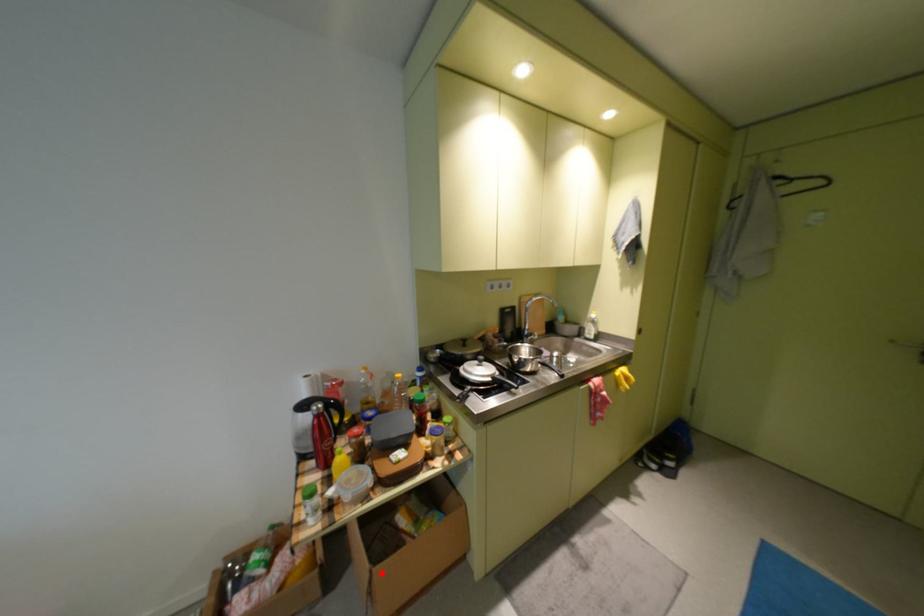
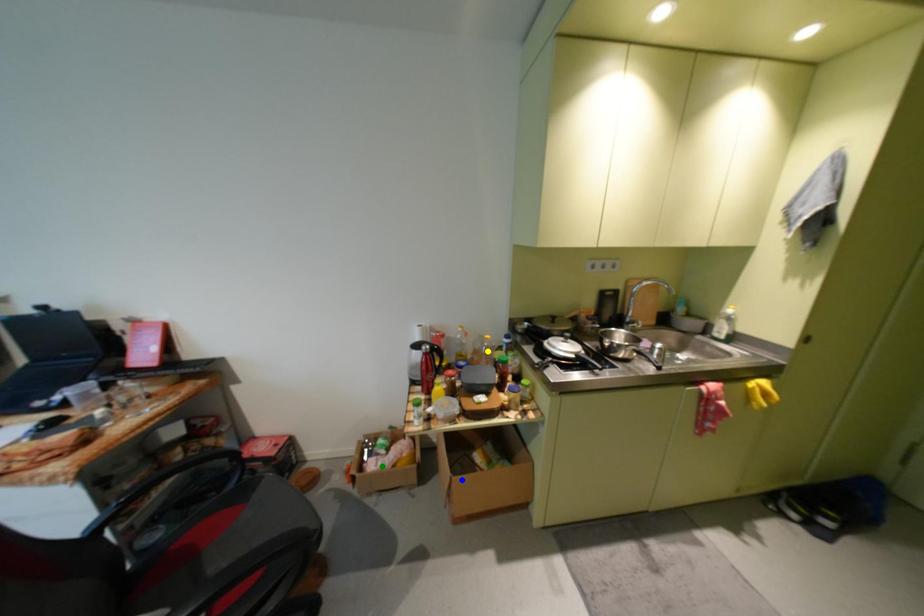
Question: I am providing you with two images of the same scene from different viewpoints. A red point is marked on the first image. You are given multiple points on the second image. Which spot in image 2 lines up with the point in image 1?

Choices:
 (A) blue point
 (B) yellow point
 (C) green point

Answer: (A)